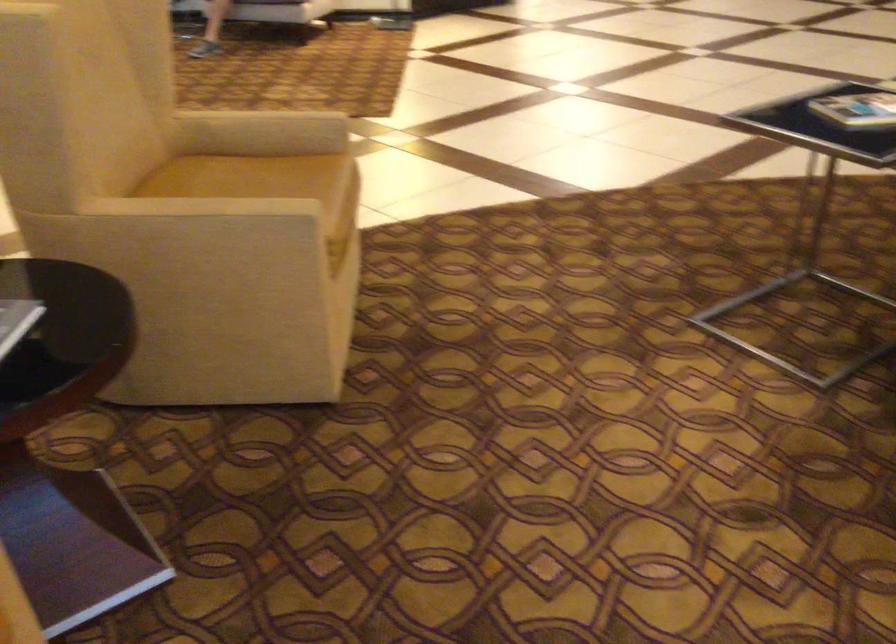
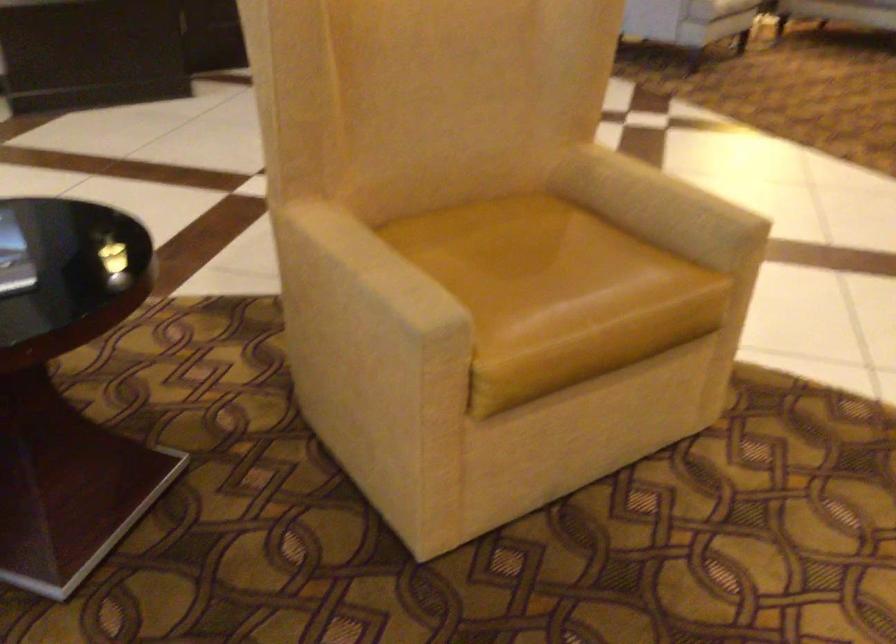
In the second image, find the point that corresponds to point 288,129 in the first image.

(659, 205)